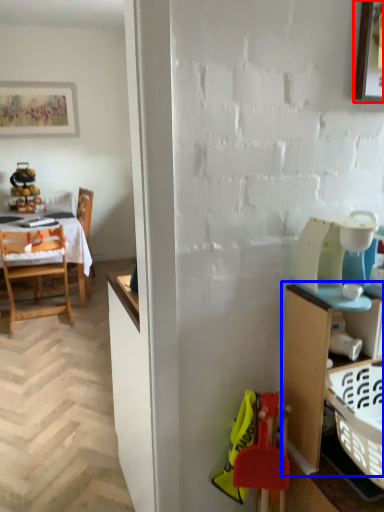
Question: Which point is further to the camera, picture frame (highlighted by a red box) or cabinetry (highlighted by a blue box)?

Choices:
 (A) picture frame
 (B) cabinetry

Answer: (A)